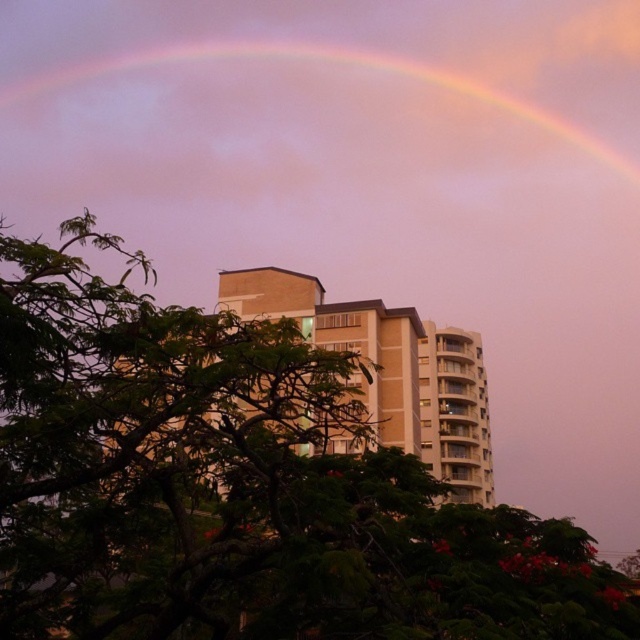
You are standing at the origin point in the urban scene. The green leafy tree at center is at coordinates 0.761 on the x and 0.372 on the y. If you want to walk directly to the tree, which direction should you head?

The green leafy tree at center is located at coordinates 0.761 on the x and 0.372 on the y. Since the x coordinate is greater than 0.5, you should head to the right. The y coordinate is 0.372, which is below the center of the image, so you should also move downward slightly to reach the tree.

You are a bird flying at the height of the green leafy tree at center. Can you see the top of the rainbow at upper center from your current position?

The green leafy tree at center has a lesser height compared to rainbow at upper center. Since the tree is shorter than the rainbow, the bird flying at the tree height can see the top of the rainbow at upper center.